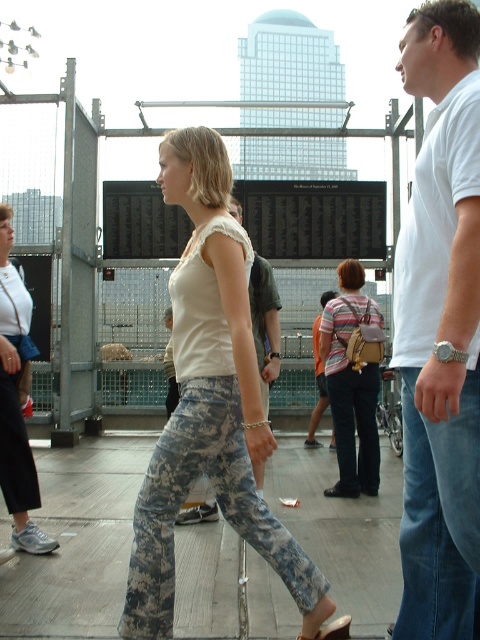
How far apart are white cotton t-shirt at center and striped cotton shirt at center?

white cotton t-shirt at center is 5.40 meters away from striped cotton shirt at center.

Can you confirm if white cotton t-shirt at center is positioned to the right of striped cotton shirt at center?

In fact, white cotton t-shirt at center is to the left of striped cotton shirt at center.

Between point (409, 566) and point (322, 408), which one is positioned in front?

Point (409, 566)

I want to click on white cotton t-shirt at center, so [x=441, y=328].

How much distance is there between camouflage pants at center and blue denim jeans at right?

A distance of 1.86 meters exists between camouflage pants at center and blue denim jeans at right.

What do you see at coordinates (78, 541) in the screenshot?
I see `camouflage pants at center` at bounding box center [78, 541].

Which is in front, point (117, 513) or point (447, 502)?

Positioned in front is point (447, 502).

Where is `camouflage pants at center`? This screenshot has height=640, width=480. camouflage pants at center is located at coordinates (78, 541).

Between point (189, 536) and point (343, 392), which one is positioned in front?

Positioned in front is point (189, 536).

Does point (225, 608) come in front of point (330, 392)?

Yes.

I want to click on camouflage pants at center, so click(x=78, y=541).